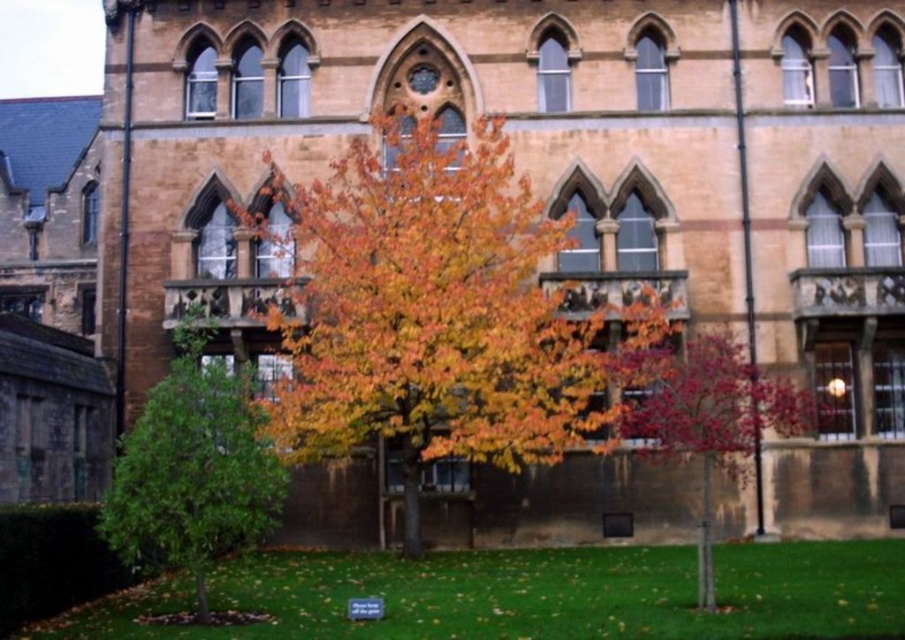
Question: Does multicolored foliage at center appear on the left side of shiny red leaves at center?

Choices:
 (A) yes
 (B) no

Answer: (A)

Question: Estimate the real-world distances between objects in this image. Which object is closer to the shiny red leaves at center?

Choices:
 (A) multicolored foliage at center
 (B) green leafy tree at lower left

Answer: (A)

Question: Does multicolored foliage at center appear over shiny red leaves at center?

Choices:
 (A) no
 (B) yes

Answer: (B)

Question: Which object appears closest to the camera in this image?

Choices:
 (A) multicolored foliage at center
 (B) green leafy tree at lower left

Answer: (B)

Question: Does green leafy tree at lower left appear on the left side of shiny red leaves at center?

Choices:
 (A) yes
 (B) no

Answer: (A)

Question: Which point is closer to the camera?

Choices:
 (A) multicolored foliage at center
 (B) shiny red leaves at center
 (C) green leafy tree at lower left

Answer: (C)